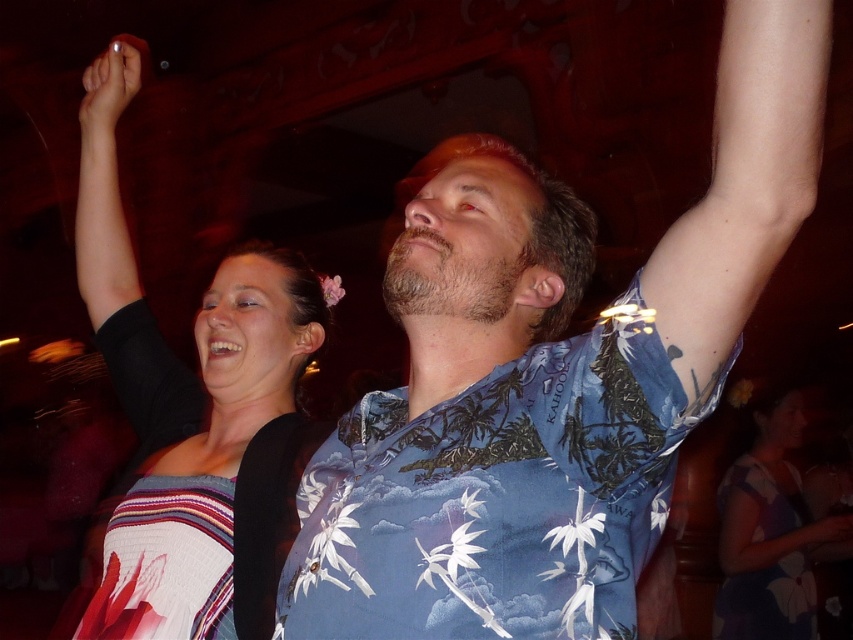
Between point (699, 403) and point (161, 355), which one is positioned behind?

The point (161, 355) is more distant.

At what (x,y) coordinates should I click in order to perform the action: click on blue floral shirt at upper center. Please return your answer as a coordinate pair (x, y). Looking at the image, I should click on (550, 381).

Is the position of matte black hand at upper left more distant than that of matte black hand at upper center?

No, matte black hand at upper left is closer to the viewer.

In the scene shown: Between matte black hand at upper left and matte black hand at upper center, which one is positioned lower?

matte black hand at upper center is below.

Is point (105, 67) less distant than point (807, 532)?

Yes.

The height and width of the screenshot is (640, 853). What are the coordinates of `matte black hand at upper left` in the screenshot? It's located at (109, 86).

Is printed fabric dress at center smaller than matte black hand at upper center?

Incorrect, printed fabric dress at center is not smaller in size than matte black hand at upper center.

You are a GUI agent. You are given a task and a screenshot of the screen. Output one action in this format:
    pyautogui.click(x=<x>, y=<y>)
    Task: Click on the printed fabric dress at center
    The height and width of the screenshot is (640, 853).
    Given the screenshot: What is the action you would take?
    pyautogui.click(x=769, y=532)